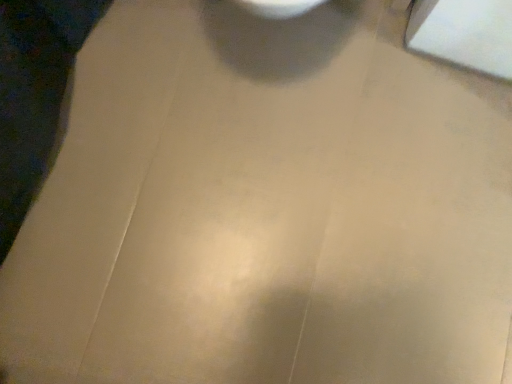
What do you see at coordinates (35, 95) in the screenshot? This screenshot has height=384, width=512. I see `dark blue denim jeans at left` at bounding box center [35, 95].

In order to face dark blue denim jeans at left, should I rotate leftwards or rightwards?

It's best to rotate left around 34.449 degrees.

Image resolution: width=512 pixels, height=384 pixels. What are the coordinates of `dark blue denim jeans at left` in the screenshot? It's located at (35, 95).

This screenshot has width=512, height=384. Find the location of `dark blue denim jeans at left`. dark blue denim jeans at left is located at coordinates (35, 95).